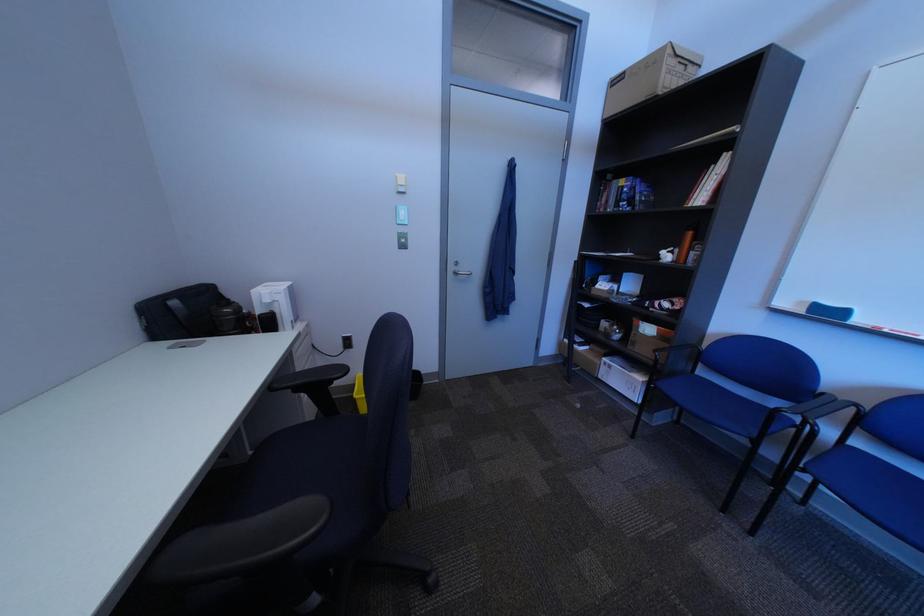
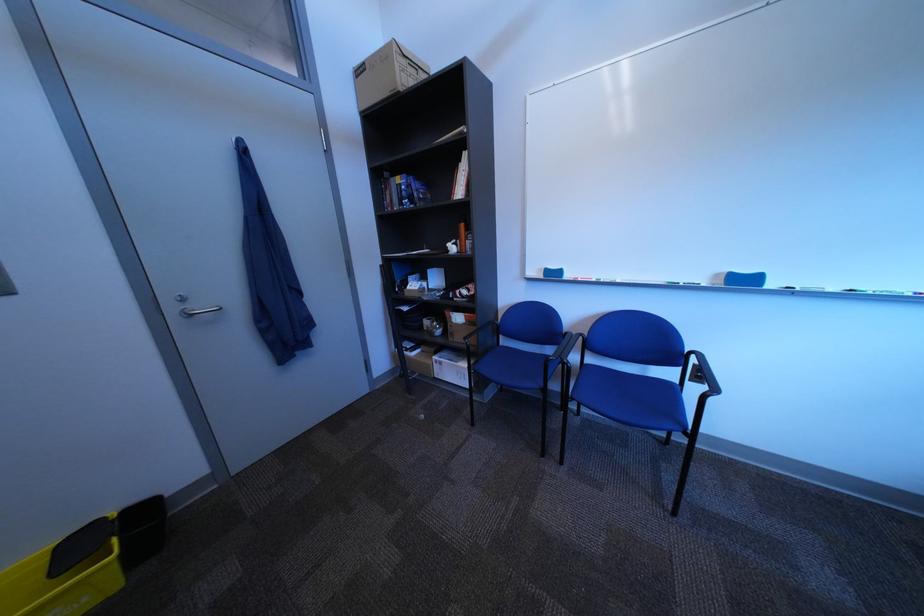
Question: How did the camera likely rotate?

Choices:
 (A) Left
 (B) Right
 (C) Up
 (D) Down

Answer: (B)